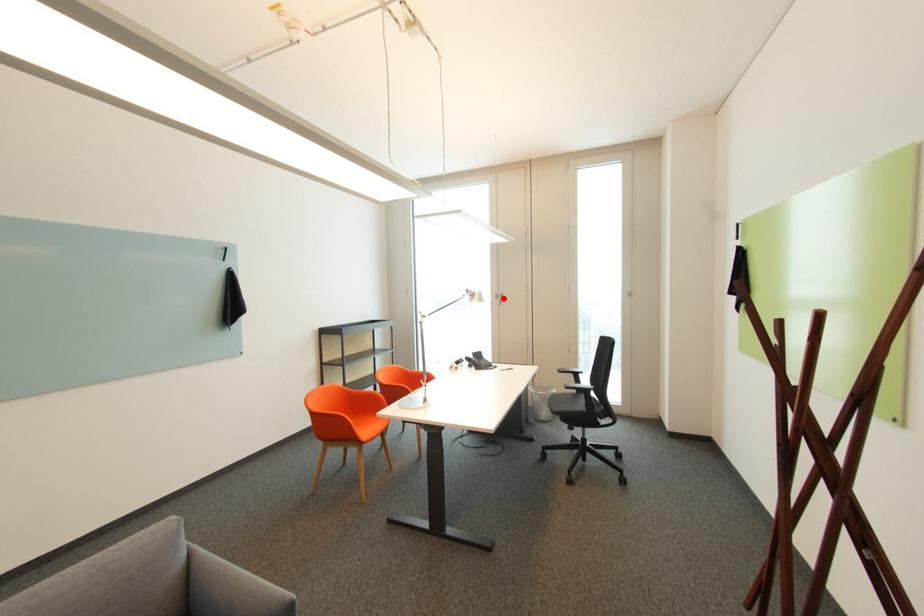
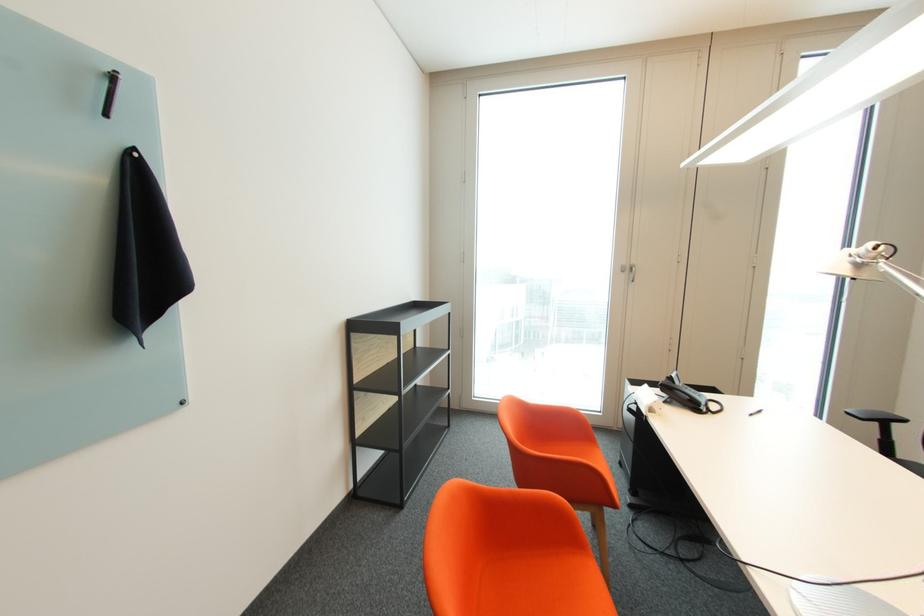
Where in the second image is the point corresponding to the highlighted location from the first image?

(629, 272)